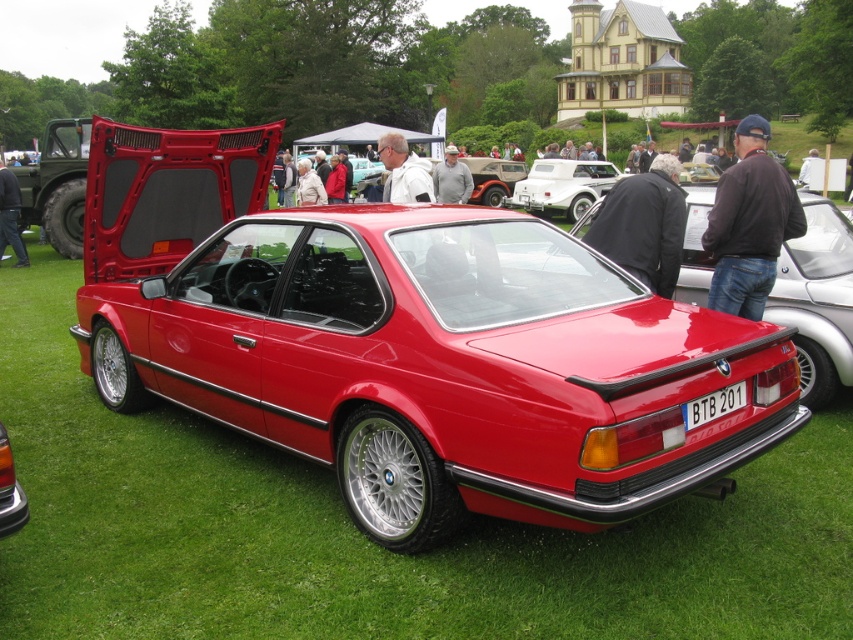
Question: Which object is positioned closest to the light beige leather jacket at center?

Choices:
 (A) brown leather jacket at center
 (B) white plastic license plate at center
 (C) jeans at lower left

Answer: (C)

Question: Does glossy red car at center come behind black leather jacket at center?

Choices:
 (A) no
 (B) yes

Answer: (B)

Question: Does white plastic license plate at center have a smaller size compared to gray sweater at center?

Choices:
 (A) yes
 (B) no

Answer: (A)

Question: Which point is closer to the camera?

Choices:
 (A) (381, 150)
 (B) (0, 211)

Answer: (A)

Question: Estimate the real-world distances between objects in this image. Which object is closer to the jeans at lower left?

Choices:
 (A) white matte convertible at center
 (B) light beige leather jacket at center
 (C) brown leather jacket at center
 (D) white plastic license plate at center

Answer: (B)

Question: Does jeans at lower left appear over gray sweater at center?

Choices:
 (A) yes
 (B) no

Answer: (B)